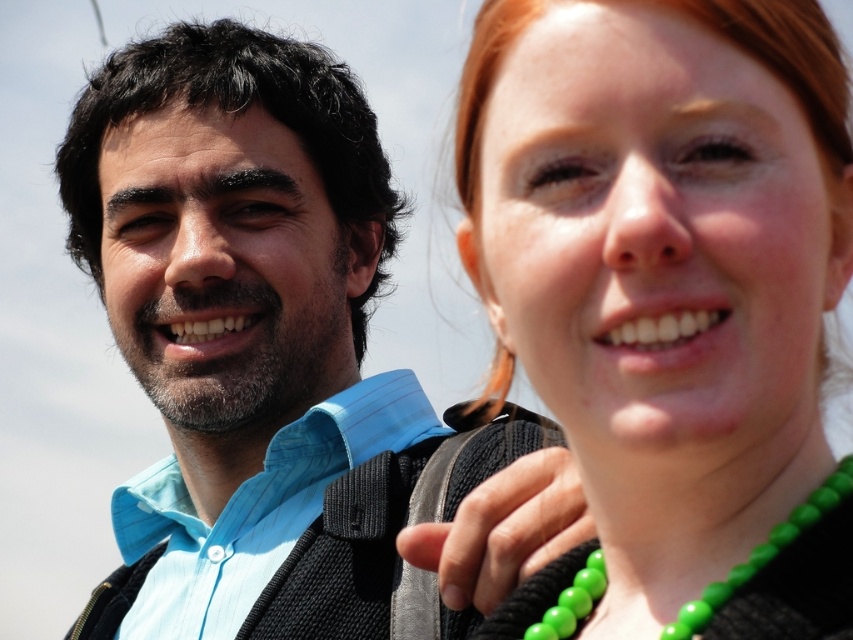
Question: Considering the real-world distances, which object is closest to the blue striped shirt at left?

Choices:
 (A) green beads at center
 (B) light blue striped shirt at left

Answer: (B)

Question: Is green beaded necklace at upper right thinner than light blue striped shirt at left?

Choices:
 (A) yes
 (B) no

Answer: (A)

Question: Can you confirm if green beaded necklace at upper right is smaller than blue striped shirt at left?

Choices:
 (A) yes
 (B) no

Answer: (A)

Question: Which of these objects is positioned closest to the light blue striped shirt at left?

Choices:
 (A) green beaded necklace at upper right
 (B) blue striped shirt at left
 (C) green beads at center

Answer: (B)

Question: Is light blue striped shirt at left in front of green beads at center?

Choices:
 (A) no
 (B) yes

Answer: (A)

Question: Considering the real-world distances, which object is closest to the blue striped shirt at left?

Choices:
 (A) green beaded necklace at upper right
 (B) green beads at center

Answer: (A)